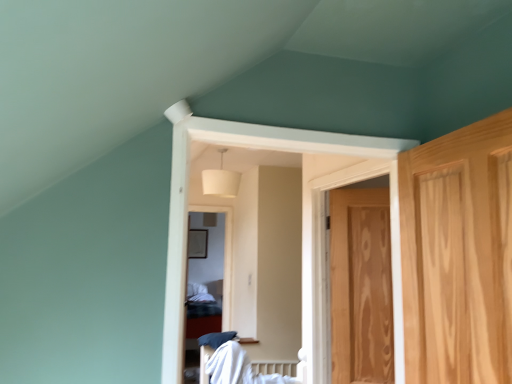
Question: Is white fabric lampshade at upper center taller than wooden door at right?

Choices:
 (A) yes
 (B) no

Answer: (B)

Question: From the image's perspective, is white fabric lampshade at upper center over wooden door at right?

Choices:
 (A) yes
 (B) no

Answer: (A)

Question: Considering the relative sizes of white fabric lampshade at upper center and wooden door at right in the image provided, is white fabric lampshade at upper center wider than wooden door at right?

Choices:
 (A) no
 (B) yes

Answer: (B)

Question: Is white fabric lampshade at upper center smaller than wooden door at right?

Choices:
 (A) no
 (B) yes

Answer: (A)

Question: Is white fabric lampshade at upper center shorter than wooden door at right?

Choices:
 (A) yes
 (B) no

Answer: (A)

Question: Is white fabric lampshade at upper center facing away from wooden door at right?

Choices:
 (A) yes
 (B) no

Answer: (B)

Question: Is wooden door at right closer to the viewer compared to white cotton bed at center?

Choices:
 (A) yes
 (B) no

Answer: (B)

Question: From the image's perspective, would you say wooden door at right is positioned over white cotton bed at center?

Choices:
 (A) yes
 (B) no

Answer: (A)

Question: Considering the relative positions of wooden door at right and white cotton bed at center in the image provided, is wooden door at right to the right of white cotton bed at center from the viewer's perspective?

Choices:
 (A) no
 (B) yes

Answer: (B)

Question: Can you confirm if wooden door at right is positioned to the left of white cotton bed at center?

Choices:
 (A) no
 (B) yes

Answer: (A)

Question: Does wooden door at right have a lesser width compared to white cotton bed at center?

Choices:
 (A) no
 (B) yes

Answer: (B)

Question: From a real-world perspective, is wooden door at right positioned over white cotton bed at center based on gravity?

Choices:
 (A) yes
 (B) no

Answer: (A)

Question: Is white cotton bed at center taller than white fabric lampshade at upper center?

Choices:
 (A) yes
 (B) no

Answer: (B)